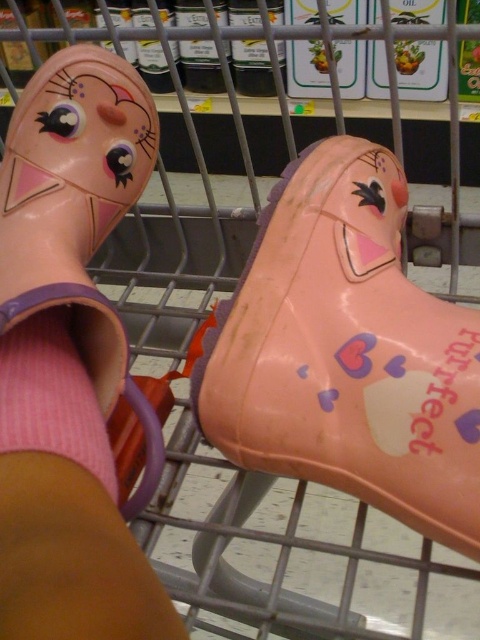
Question: Which point is farther to the camera?

Choices:
 (A) (113, 173)
 (B) (44, 444)
 (C) (60, 500)
 (D) (262, 360)

Answer: (A)

Question: Which point is closer to the camera taking this photo?

Choices:
 (A) (60, 156)
 (B) (24, 426)

Answer: (B)

Question: Can you confirm if pink rubber boot at center is thinner than rubber boot at lower left?

Choices:
 (A) yes
 (B) no

Answer: (A)

Question: Which object is the farthest from the pink rubber boot at center?

Choices:
 (A) rubber boot at lower left
 (B) pink knitted sock at lower left
 (C) matte pink rubber boot at upper left

Answer: (C)

Question: From the image, what is the correct spatial relationship of rubber boot at lower left in relation to matte pink rubber boot at upper left?

Choices:
 (A) above
 (B) below

Answer: (B)

Question: Can you confirm if rubber boot at lower left is thinner than pink knitted sock at lower left?

Choices:
 (A) no
 (B) yes

Answer: (A)